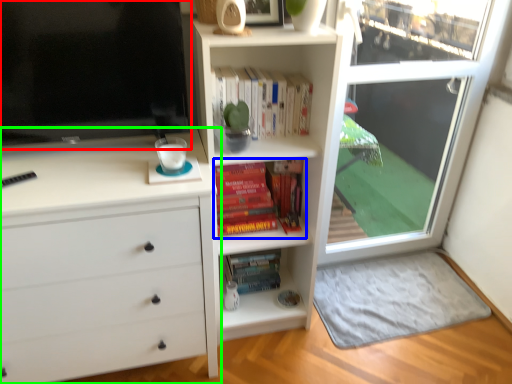
Question: Considering the real-world distances, which object is farthest from television (highlighted by a red box)? book (highlighted by a blue box) or chest of drawers (highlighted by a green box)?

Choices:
 (A) book
 (B) chest of drawers

Answer: (A)